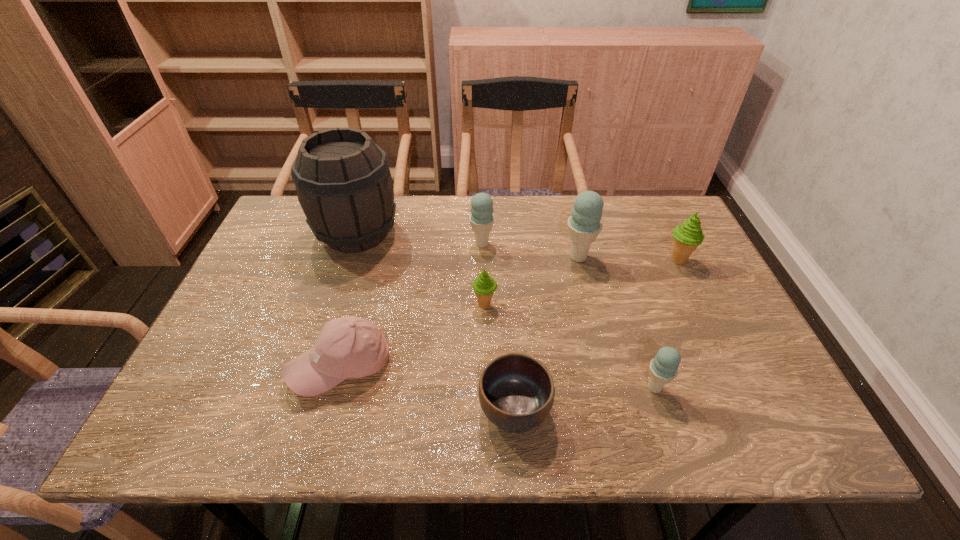
This screenshot has height=540, width=960. What are the coordinates of `blank space at the near left corner of the desktop` in the screenshot? It's located at (237, 438).

Identify the location of vacant region at the far right corner of the desktop. (643, 205).

You are a GUI agent. You are given a task and a screenshot of the screen. Output one action in this format:
    pyautogui.click(x=<x>, y=<y>)
    Task: Click on the free area in between the bowl and the wine bucket
    This screenshot has height=540, width=960.
    Given the screenshot: What is the action you would take?
    pyautogui.click(x=436, y=322)

What are the coordinates of `free space between the tallest object and the second nearest icecream` in the screenshot? It's located at (420, 269).

Locate an element on the screen. unoccupied area between the right green icecream and the pink baseball cap is located at coordinates (510, 313).

At what (x,y) coordinates should I click in order to perform the action: click on empty space that is in between the biggest blue ice cream and the bowl. Please return your answer as a coordinate pair (x, y). This screenshot has height=540, width=960. Looking at the image, I should click on (546, 333).

Find the location of a particular element. free area in between the bowl and the pink baseball cap is located at coordinates (428, 388).

Locate an element on the screen. The height and width of the screenshot is (540, 960). free point between the tallest object and the leftmost blue ice cream is located at coordinates (420, 239).

What are the coordinates of `vacant space in between the baseball cap and the right green icecream` in the screenshot? It's located at (510, 313).

Locate an element on the screen. empty space between the baseball cap and the second smallest blue ice cream is located at coordinates (412, 305).